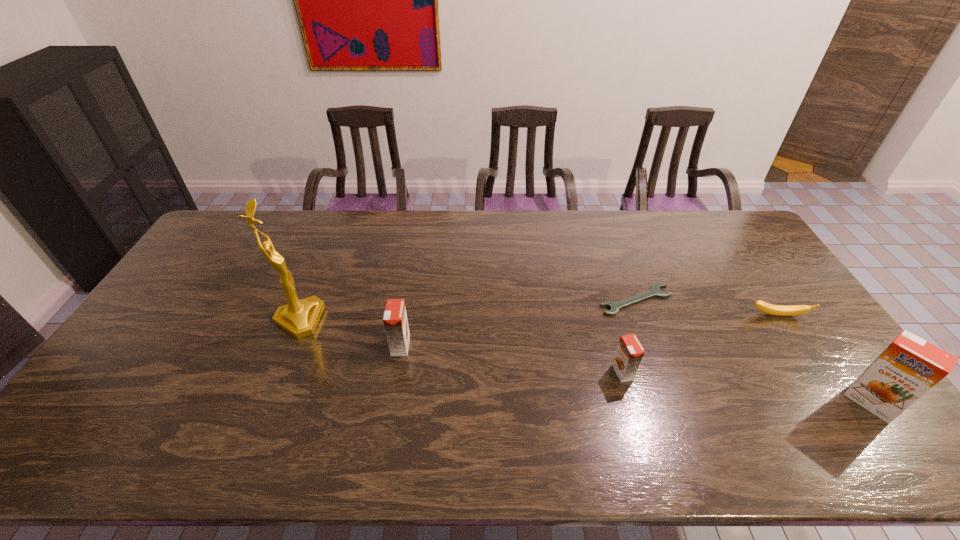
Where is `the leftmost orange juice`? the leftmost orange juice is located at coordinates (395, 321).

The image size is (960, 540). I want to click on the fifth object from right to left, so click(x=395, y=321).

Where is `the shortest orange juice`? the shortest orange juice is located at coordinates (629, 353).

Locate an element on the screen. the second orange juice from right to left is located at coordinates coord(629,353).

Locate an element on the screen. the tallest orange juice is located at coordinates (910, 366).

The image size is (960, 540). What are the coordinates of `the second tallest object` in the screenshot? It's located at (910, 366).

Locate an element on the screen. This screenshot has height=540, width=960. wrench is located at coordinates (655, 291).

This screenshot has width=960, height=540. I want to click on award, so click(x=300, y=318).

In order to click on the leftmost object in this screenshot , I will do `click(300, 318)`.

You are a GUI agent. You are given a task and a screenshot of the screen. Output one action in this format:
    pyautogui.click(x=<x>, y=<y>)
    Task: Click on the banana
    This screenshot has width=960, height=540.
    Given the screenshot: What is the action you would take?
    pyautogui.click(x=778, y=310)